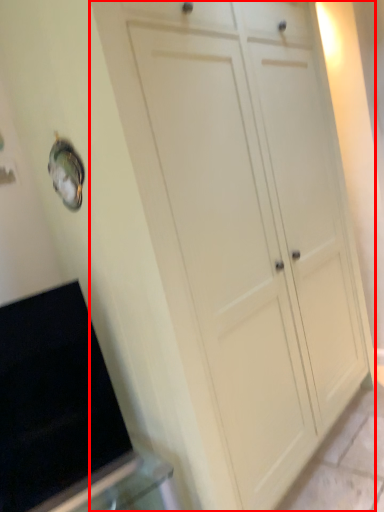
Question: From the image's perspective, considering the relative positions of cupboard (annotated by the red box) and appliance in the image provided, where is cupboard (annotated by the red box) located with respect to the staircase?

Choices:
 (A) below
 (B) above

Answer: (B)